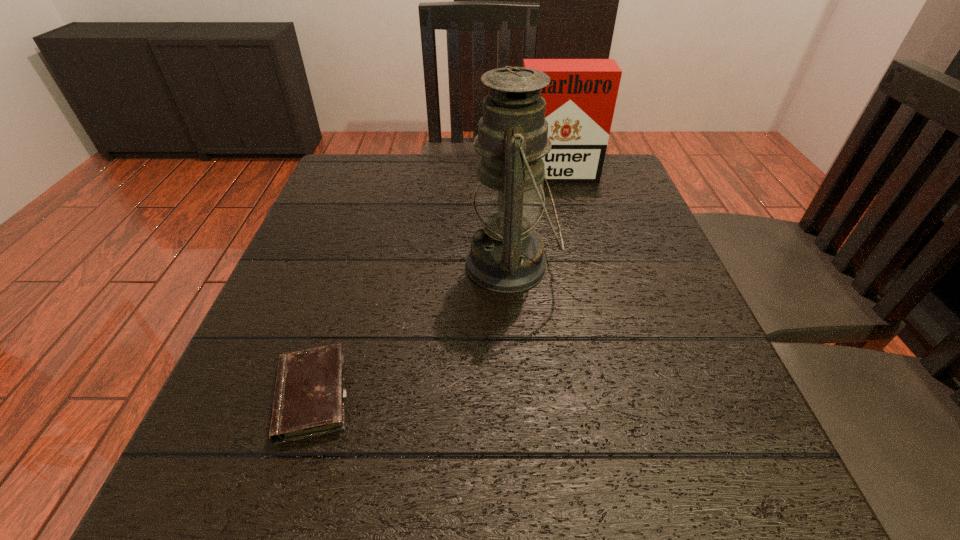
Where is `the second nearest object`? This screenshot has width=960, height=540. the second nearest object is located at coordinates (506, 255).

Where is `oil lamp`? The image size is (960, 540). oil lamp is located at coordinates (506, 255).

Identify the location of cigarette case. (580, 99).

Where is `the second tallest object`? the second tallest object is located at coordinates (580, 99).

This screenshot has width=960, height=540. In order to click on the nearest object in this screenshot , I will do `click(309, 397)`.

Identify the location of the leftmost object. [x=309, y=397].

I want to click on free spot located on the front of the second nearest object, so [516, 336].

The height and width of the screenshot is (540, 960). In order to click on vacant space located on the front-facing side of the cigarette case in this screenshot , I will do `click(569, 280)`.

Where is `free location located 0.300m on the right of the shortest object`? Image resolution: width=960 pixels, height=540 pixels. free location located 0.300m on the right of the shortest object is located at coordinates (554, 396).

Identify the location of object that is at the far edge. (580, 99).